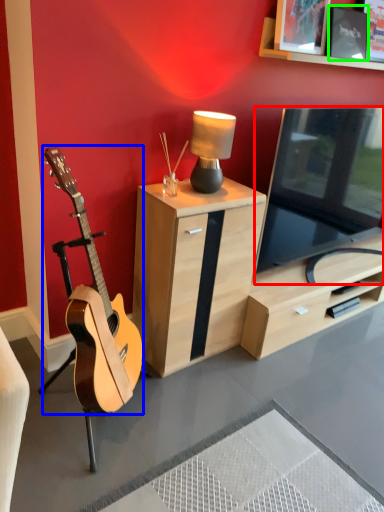
Question: Which is farther away from television (highlighted by a red box)? guitar (highlighted by a blue box) or picture frame (highlighted by a green box)?

Choices:
 (A) guitar
 (B) picture frame

Answer: (A)